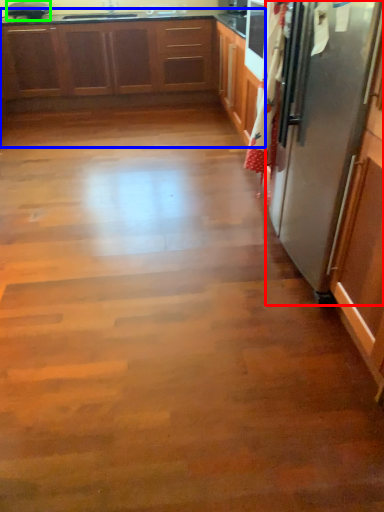
Question: Estimate the real-world distances between objects in this image. Which object is closer to refrigerator (highlighted by a red box), cabinetry (highlighted by a blue box) or appliance (highlighted by a green box)?

Choices:
 (A) cabinetry
 (B) appliance

Answer: (A)